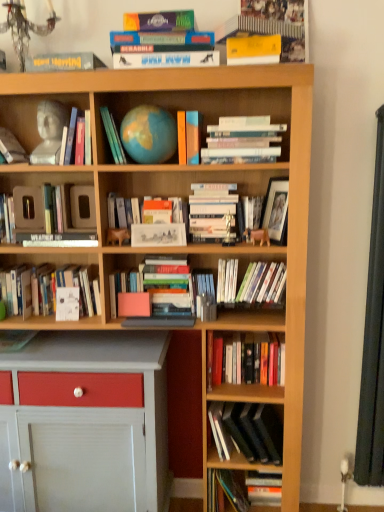
What do you see at coordinates (113, 136) in the screenshot? Image resolution: width=384 pixels, height=512 pixels. I see `matte blue globe at center, which ranks as the 3th book in top-to-bottom order` at bounding box center [113, 136].

What do you see at coordinates (279, 24) in the screenshot?
I see `yellow paper at upper center, acting as the first book starting from the top` at bounding box center [279, 24].

Measure the distance between point [70,126] and camera.

The depth of point [70,126] is 5.78 feet.

Identify the location of hardcover book at left, the fourth book positioned from the top. The width and height of the screenshot is (384, 512). (68, 137).

What are the coordinates of `hardcover books at center, the second book in the bottom-to-top sequence` in the screenshot? It's located at pos(247,431).

The width and height of the screenshot is (384, 512). In order to click on matte blue globe at center, the 14th book when ordered from bottom to top in this screenshot , I will do `click(113, 136)`.

Is white paperbacks at upper center, acting as the eleventh book starting from the bottom, thinner than hardcover book at center, the 8th book in the top-to-bottom sequence?

In fact, white paperbacks at upper center, acting as the eleventh book starting from the bottom, might be wider than hardcover book at center, the 8th book in the top-to-bottom sequence.

Is white paperbacks at upper center, the sixth book viewed from the top, located outside hardcover book at center, placed as the ninth book when sorted from bottom to top?

Indeed, white paperbacks at upper center, the sixth book viewed from the top, is completely outside hardcover book at center, placed as the ninth book when sorted from bottom to top.

From the image's perspective, which one is positioned higher, white paperbacks at upper center, the sixth book viewed from the top, or hardcover book at center, the 8th book in the top-to-bottom sequence?

white paperbacks at upper center, the sixth book viewed from the top, from the image's perspective.

Who is taller, hardcover book at center, which is the 12th book in bottom-to-top order, or yellow paper at upper center, arranged as the 16th book when ordered from the bottom?

yellow paper at upper center, arranged as the 16th book when ordered from the bottom, is taller.

Is hardcover book at center, which is the 12th book in bottom-to-top order, oriented away from yellow paper at upper center, arranged as the 16th book when ordered from the bottom?

No.

Does yellow paper at upper center, arranged as the 16th book when ordered from the bottom, have a smaller size compared to yellow paper at upper center?

No, yellow paper at upper center, arranged as the 16th book when ordered from the bottom, is not smaller than yellow paper at upper center.

Considering the relative positions of yellow paper at upper center, arranged as the 16th book when ordered from the bottom, and yellow paper at upper center in the image provided, is yellow paper at upper center, arranged as the 16th book when ordered from the bottom, to the right of yellow paper at upper center from the viewer's perspective?

Yes, yellow paper at upper center, arranged as the 16th book when ordered from the bottom, is to the right of yellow paper at upper center.

Is point (281, 59) positioned behind point (250, 50)?

Yes, point (281, 59) is farther from viewer.

Which object is positioned more to the left, hardcover book at lower right, the sixteenth book viewed from the top, or matte white bust at upper left?

matte white bust at upper left is more to the left.

Would you say matte white bust at upper left is part of hardcover book at lower right, the sixteenth book viewed from the top,'s contents?

Actually, matte white bust at upper left is outside hardcover book at lower right, the sixteenth book viewed from the top.

The image size is (384, 512). What are the coordinates of `person in front of the hardcover book at lower right, the sixteenth book viewed from the top` in the screenshot? It's located at (50, 132).

Is hardcover book at lower right, the sixteenth book viewed from the top, turned away from matte white bust at upper left?

hardcover book at lower right, the sixteenth book viewed from the top, is not turned away from matte white bust at upper left.

From a real-world perspective, is hardcover book at center, which is the 12th book in bottom-to-top order, located beneath matte white bust at upper left?

Yes, from a real-world perspective, hardcover book at center, which is the 12th book in bottom-to-top order, is under matte white bust at upper left.

Is hardcover book at center, acting as the 5th book starting from the top, oriented away from matte white bust at upper left?

No, hardcover book at center, acting as the 5th book starting from the top,'s orientation is not away from matte white bust at upper left.

Is hardcover book at center, which is the 12th book in bottom-to-top order, with matte white bust at upper left?

They are not placed beside each other.

Is the depth of hardcover book at center, which is the 12th book in bottom-to-top order, less than that of matte white bust at upper left?

That is True.

Is white paper at center, the 8th book in the bottom-to-top sequence, outside of clear plastic book at center, positioned as the fourth book in bottom-to-top order?

Indeed, white paper at center, the 8th book in the bottom-to-top sequence, is completely outside clear plastic book at center, positioned as the fourth book in bottom-to-top order.

From the image's perspective, is white paper at center, the 9th book viewed from the top, on top of clear plastic book at center, positioned as the fourth book in bottom-to-top order?

Yes, from the image's perspective, white paper at center, the 9th book viewed from the top, is over clear plastic book at center, positioned as the fourth book in bottom-to-top order.

In terms of height, does white paper at center, the 8th book in the bottom-to-top sequence, look taller or shorter compared to clear plastic book at center, positioned as the fourth book in bottom-to-top order?

Clearly, white paper at center, the 8th book in the bottom-to-top sequence, is taller compared to clear plastic book at center, positioned as the fourth book in bottom-to-top order.

Could you measure the distance between white paper at center, the 8th book in the bottom-to-top sequence, and clear plastic book at center, positioned as the fourth book in bottom-to-top order?

They are 11.24 inches apart.

Is hardcover book at center, the 8th book in the top-to-bottom sequence, with yellow paper at upper center, acting as the first book starting from the top?

No, hardcover book at center, the 8th book in the top-to-bottom sequence, is not making contact with yellow paper at upper center, acting as the first book starting from the top.

From the image's perspective, is hardcover book at center, placed as the ninth book when sorted from bottom to top, under yellow paper at upper center, acting as the first book starting from the top?

Yes, from the image's perspective, hardcover book at center, placed as the ninth book when sorted from bottom to top, is below yellow paper at upper center, acting as the first book starting from the top.

How much distance is there between hardcover book at center, the 8th book in the top-to-bottom sequence, and yellow paper at upper center, acting as the first book starting from the top?

The distance of hardcover book at center, the 8th book in the top-to-bottom sequence, from yellow paper at upper center, acting as the first book starting from the top, is 26.33 inches.

Looking at this image, considering the sizes of objects hardcover book at center, the 8th book in the top-to-bottom sequence, and yellow paper at upper center, arranged as the 16th book when ordered from the bottom, in the image provided, who is wider, hardcover book at center, the 8th book in the top-to-bottom sequence, or yellow paper at upper center, arranged as the 16th book when ordered from the bottom,?

hardcover book at center, the 8th book in the top-to-bottom sequence.

From the image's perspective, count 2nd books upward from the hardcover book at center, the 8th book in the top-to-bottom sequence, and point to it. Please provide its 2D coordinates.

[(243, 140)]

From a real-world perspective, count 4th books upward from the hardcover book at center, acting as the 5th book starting from the top, and point to it. Please provide its 2D coordinates.

[(279, 24)]

Looking at the image, which one is located further to clear plastic book at center, positioned as the fourth book in bottom-to-top order, white matte book at center, which is the 7th book from top to bottom, or matte blue globe at center, the 14th book when ordered from bottom to top?

matte blue globe at center, the 14th book when ordered from bottom to top, is further to clear plastic book at center, positioned as the fourth book in bottom-to-top order.

Looking at the image, which one is located further to hardcover books at center, which is the 6th book from bottom to top, matte white bust at upper left or clear plastic book at center, positioned as the fourth book in bottom-to-top order?

The object further to hardcover books at center, which is the 6th book from bottom to top, is matte white bust at upper left.

Looking at this image, looking at the image, which one is located further to hardcover book at left, the fourth book positioned from the top, hardcover book at center, placed as the ninth book when sorted from bottom to top, or matte blue globe at center, the 14th book when ordered from bottom to top?

hardcover book at center, placed as the ninth book when sorted from bottom to top, lies further to hardcover book at left, the fourth book positioned from the top, than the other object.

Considering their positions, is clear plastic book at center, the thirteenth book from the top, positioned closer to white paperbacks at upper center, acting as the eleventh book starting from the bottom, than hardcover book at center, placed as the ninth book when sorted from bottom to top?

Among the two, hardcover book at center, placed as the ninth book when sorted from bottom to top, is located nearer to white paperbacks at upper center, acting as the eleventh book starting from the bottom.

Which object lies nearer to the anchor point hardcover book at left, the fourth book positioned from the top, hardcover books at center, marked as the 3th book in a bottom-to-top arrangement, or white paper at center, the 8th book in the bottom-to-top sequence?

white paper at center, the 8th book in the bottom-to-top sequence.

Looking at the image, which one is located closer to hardcover book at center, the 7th book in the bottom-to-top sequence, hardcover books at center, which ranks as the 11th book in top-to-bottom order, or yellow paper at upper center, arranged as the 16th book when ordered from the bottom?

Based on the image, hardcover books at center, which ranks as the 11th book in top-to-bottom order, appears to be nearer to hardcover book at center, the 7th book in the bottom-to-top sequence.

Based on their spatial positions, is clear plastic book at center, positioned as the fourth book in bottom-to-top order, or hardcover book at left, marked as the 13th book in a bottom-to-top arrangement, further from white paperbacks at upper center, the sixth book viewed from the top?

Based on the image, hardcover book at left, marked as the 13th book in a bottom-to-top arrangement, appears to be further to white paperbacks at upper center, the sixth book viewed from the top.

Looking at the image, which one is located further to hardcover books at center, which is the 6th book from bottom to top, white paperbacks at upper center, acting as the eleventh book starting from the bottom, or hardcover book at left, the fourth book positioned from the top?

Based on the image, hardcover book at left, the fourth book positioned from the top, appears to be further to hardcover books at center, which is the 6th book from bottom to top.

Where is `person that lies between yellow paper at upper center and hardcover books at center, which ranks as the 11th book in top-to-bottom order, from top to bottom`? This screenshot has width=384, height=512. person that lies between yellow paper at upper center and hardcover books at center, which ranks as the 11th book in top-to-bottom order, from top to bottom is located at coordinates (50, 132).

Where is `paperback book between yellow paper at upper center, arranged as the 16th book when ordered from the bottom, and hardcover books at center, which ranks as the 11th book in top-to-bottom order, from top to bottom`? This screenshot has width=384, height=512. paperback book between yellow paper at upper center, arranged as the 16th book when ordered from the bottom, and hardcover books at center, which ranks as the 11th book in top-to-bottom order, from top to bottom is located at coordinates (253, 50).

At what (x,y) coordinates should I click in order to perform the action: click on paperback book between matte blue globe at center, the 14th book when ordered from bottom to top, and hardcover book at center, placed as the ninth book when sorted from bottom to top, in the horizontal direction. Please return your answer as a coordinate pair (x, y). The height and width of the screenshot is (512, 384). Looking at the image, I should click on (253, 50).

Where is `person between yellow paper at upper center and hardcover book at lower right, the sixteenth book viewed from the top, vertically`? Image resolution: width=384 pixels, height=512 pixels. person between yellow paper at upper center and hardcover book at lower right, the sixteenth book viewed from the top, vertically is located at coordinates (50, 132).